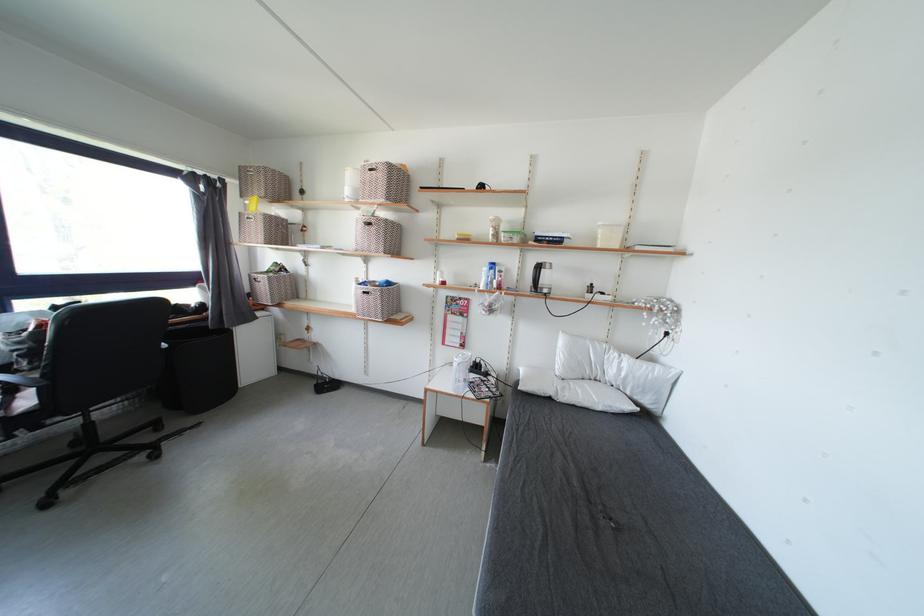
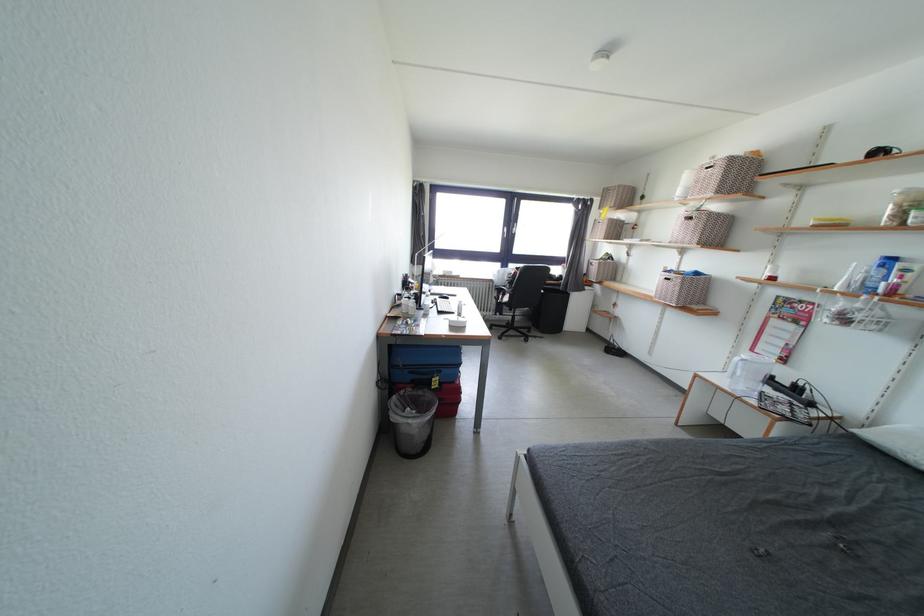
Locate, in the second image, the point that corresponds to the point at 35,359 in the first image.

(517, 286)